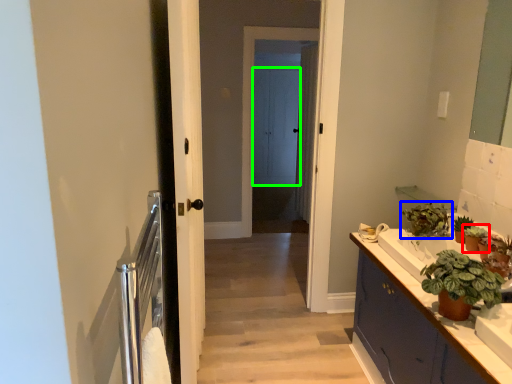
Question: Which object is positioned closest to houseplant (highlighted by a red box)? Select from houseplant (highlighted by a blue box) and screen door (highlighted by a green box).

Choices:
 (A) houseplant
 (B) screen door

Answer: (A)